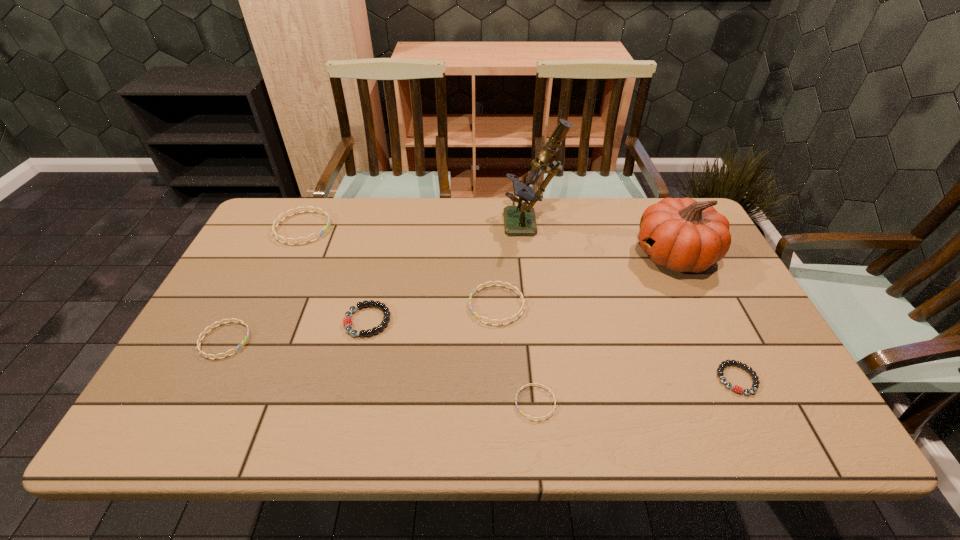
Where is `vacant area situated 0.320m on the surface of the biggest blue bracelet showing star-shaped elements`? The height and width of the screenshot is (540, 960). vacant area situated 0.320m on the surface of the biggest blue bracelet showing star-shaped elements is located at coordinates (430, 228).

Where is `free spot located 0.240m on the surface of the third smallest blue bracelet showing star-shaped elements`? The width and height of the screenshot is (960, 540). free spot located 0.240m on the surface of the third smallest blue bracelet showing star-shaped elements is located at coordinates (379, 305).

You are a GUI agent. You are given a task and a screenshot of the screen. Output one action in this format:
    pyautogui.click(x=<x>, y=<y>)
    Task: Click on the vacant space situated 0.350m on the surface of the third smallest blue bracelet showing star-shaped elements
    
    Given the screenshot: What is the action you would take?
    pyautogui.click(x=337, y=305)

Where is `vacant space located on the surface of the third smallest blue bracelet showing star-shaped elements`? vacant space located on the surface of the third smallest blue bracelet showing star-shaped elements is located at coordinates (450, 305).

I want to click on free space located 0.230m on the right of the farther black bracelet, so click(480, 321).

You are a GUI agent. You are given a task and a screenshot of the screen. Output one action in this format:
    pyautogui.click(x=<x>, y=<y>)
    Task: Click on the free space located 0.220m on the surface of the second smallest blue bracelet showing star-shaped elements
    The width and height of the screenshot is (960, 540).
    Given the screenshot: What is the action you would take?
    click(x=338, y=340)

At what (x,y) coordinates should I click in order to perform the action: click on free spot located 0.400m on the back of the rightmost bracelet. Please return your answer as a coordinate pair (x, y). Looking at the image, I should click on 675,252.

Locate an element on the screen. The image size is (960, 540). free spot located on the surface of the smallest blue bracelet showing star-shaped elements is located at coordinates coord(410,403).

The height and width of the screenshot is (540, 960). I want to click on free region located on the surface of the smallest blue bracelet showing star-shaped elements, so click(x=405, y=403).

Identify the location of vacant point located on the surface of the smallest blue bracelet showing star-shaped elements. click(x=420, y=403).